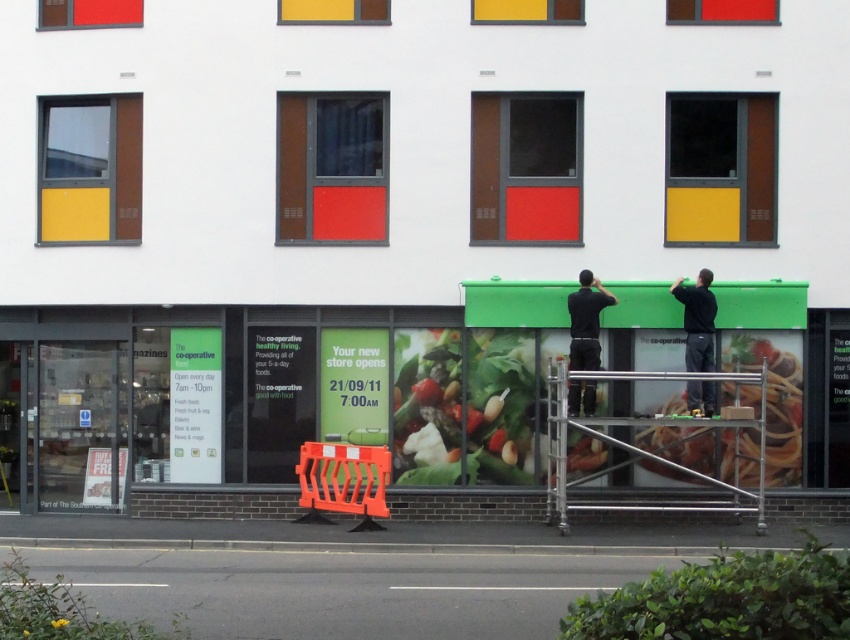
You are a delivery person who needs to place a 24 inch box between the green matte spaghetti at lower right and the dark gray shirt at center. Can you fit it without overlapping either object?

The green matte spaghetti at lower right is 26.11 inches from the dark gray shirt at center. Since the box is 24 inches long, there is enough space between them to place it without overlapping either object.

You are standing in front of the building and want to find the green matte vegetable at center. According to the store layout, where should you look relative to the building?

The green matte vegetable at center is located at the coordinates 0.637 on the x axis and 0.549 on the y axis relative to the building.

What is the spatial relationship between the green matte spaghetti at lower right and the dark gray shirt at center in the image?

The green matte spaghetti at lower right is located to the right of the dark gray shirt at center.